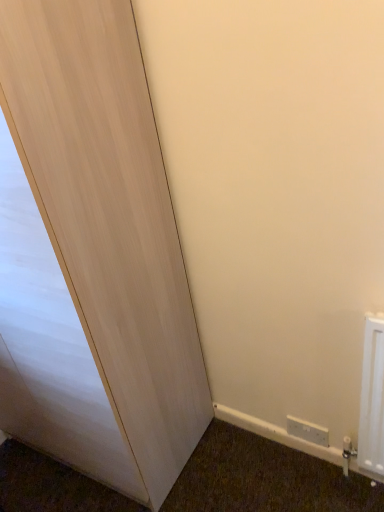
Question: Would you say white plastic electric outlet at lower right is inside or outside light wood door at left?

Choices:
 (A) outside
 (B) inside

Answer: (A)

Question: From a real-world perspective, relative to light wood door at left, is white plastic electric outlet at lower right vertically above or below?

Choices:
 (A) above
 (B) below

Answer: (B)

Question: Looking at their shapes, would you say white plastic electric outlet at lower right is wider or thinner than light wood door at left?

Choices:
 (A) thin
 (B) wide

Answer: (A)

Question: Considering the positions of point (67, 324) and point (288, 420), is point (67, 324) closer or farther from the camera than point (288, 420)?

Choices:
 (A) farther
 (B) closer

Answer: (B)

Question: Is light wood door at left in front of or behind white plastic electric outlet at lower right in the image?

Choices:
 (A) front
 (B) behind

Answer: (A)

Question: Is light wood door at left taller or shorter than white plastic electric outlet at lower right?

Choices:
 (A) tall
 (B) short

Answer: (A)

Question: From a real-world perspective, is light wood door at left positioned above or below white plastic electric outlet at lower right?

Choices:
 (A) above
 (B) below

Answer: (A)